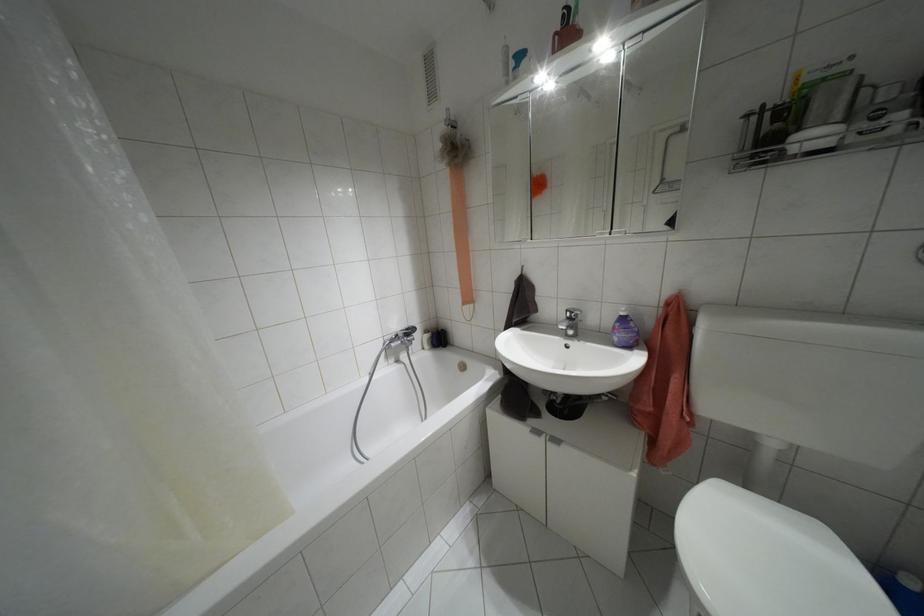
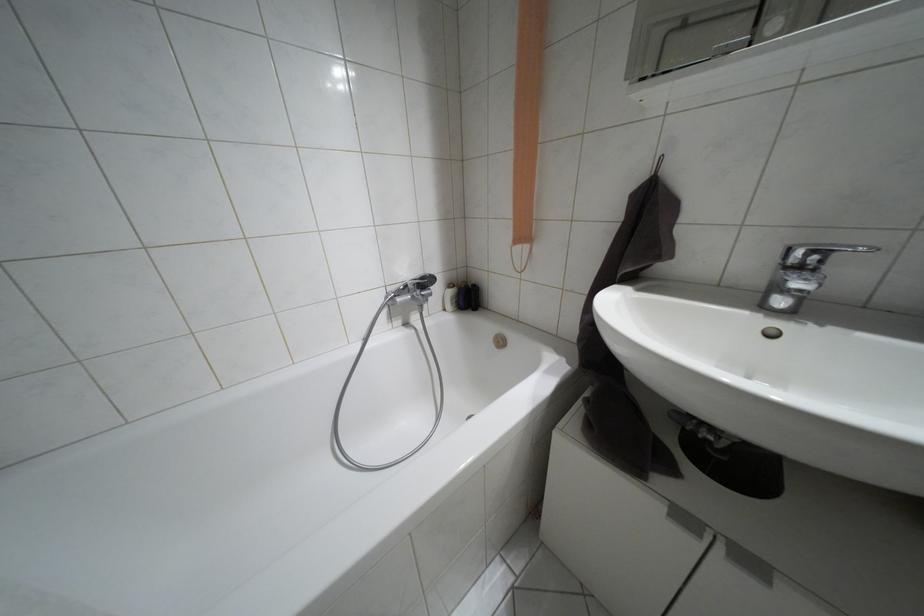
Where in the second image is the point corresponding to (x=570, y=312) from the first image?

(810, 253)